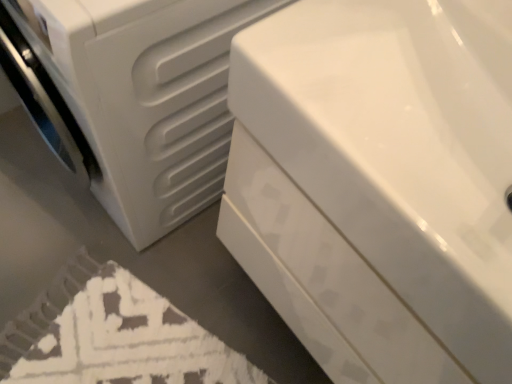
Question: From a real-world perspective, is white glossy bathtub at center above or below white textured bath mat at lower left?

Choices:
 (A) below
 (B) above

Answer: (B)

Question: Considering the positions of white glossy bathtub at center and white textured bath mat at lower left in the image, is white glossy bathtub at center taller or shorter than white textured bath mat at lower left?

Choices:
 (A) tall
 (B) short

Answer: (A)

Question: Which of these objects is positioned farthest from the white glossy bathtub at center?

Choices:
 (A) white textured bath mat at lower left
 (B) white matte washing machine at left

Answer: (A)

Question: Which is nearer to the white glossy bathtub at center?

Choices:
 (A) white textured bath mat at lower left
 (B) white matte washing machine at left

Answer: (B)